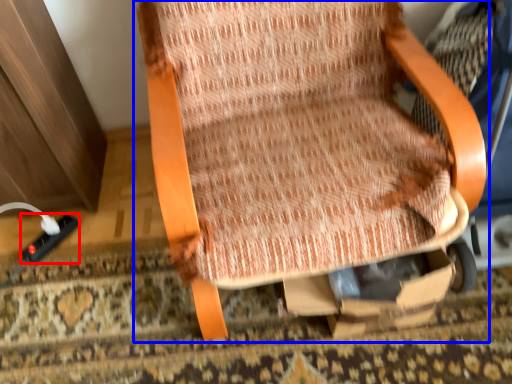
Question: Which point is closer to the camera, plug (highlighted by a red box) or chair (highlighted by a blue box)?

Choices:
 (A) plug
 (B) chair

Answer: (B)